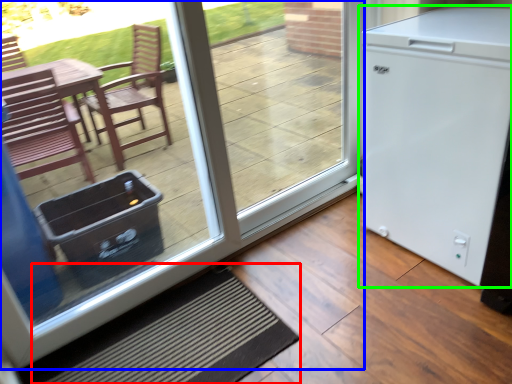
Question: Estimate the real-world distances between objects in this image. Which object is farther from doormat (highlighted by a red box), door (highlighted by a blue box) or refrigerator (highlighted by a green box)?

Choices:
 (A) door
 (B) refrigerator

Answer: (B)